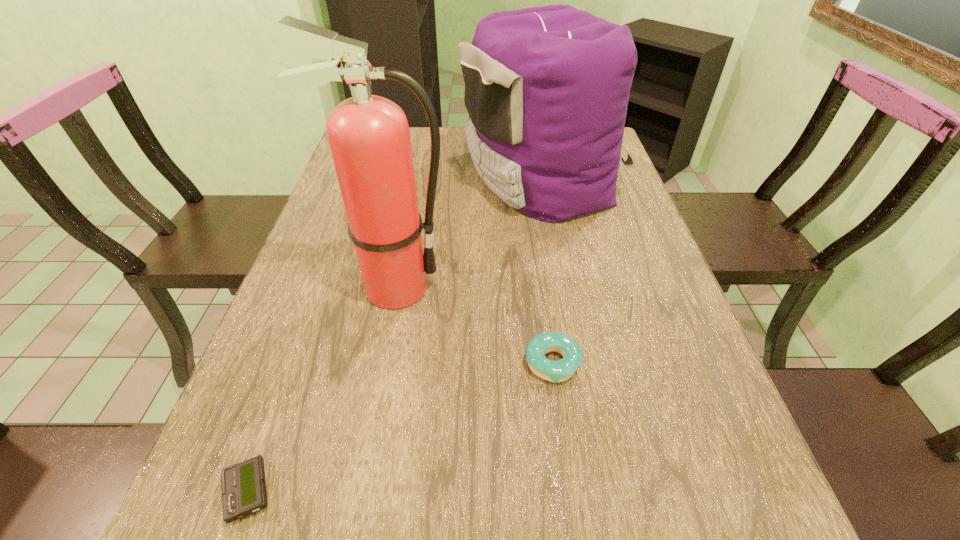
You are a GUI agent. You are given a task and a screenshot of the screen. Output one action in this format:
    pyautogui.click(x=<x>, y=<y>)
    Task: Click on the free space that satisfies the following two spatial constraints: 1. on the hose direction of the second nearest object; 2. on the left side of the tallest object
    
    Given the screenshot: What is the action you would take?
    pyautogui.click(x=379, y=363)

This screenshot has width=960, height=540. What are the coordinates of `free location that satisfies the following two spatial constraints: 1. on the hose direction of the tallest object; 2. on the back side of the second shortest object` in the screenshot? It's located at (379, 363).